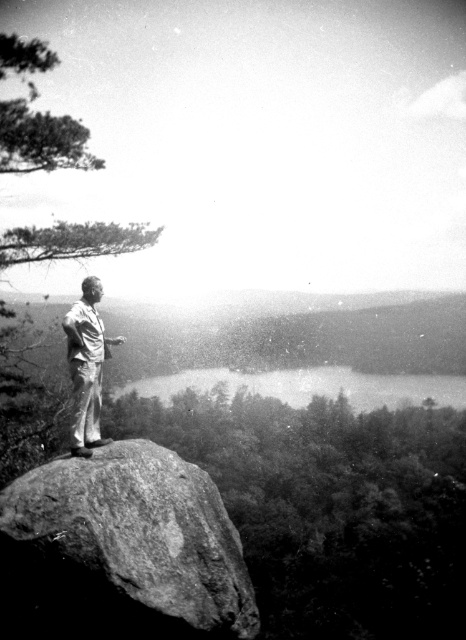
Can you confirm if smooth granite boulder at center is positioned to the right of smooth water at center?

Incorrect, smooth granite boulder at center is not on the right side of smooth water at center.

The height and width of the screenshot is (640, 466). I want to click on smooth granite boulder at center, so click(x=122, y=550).

Where is `smooth granite boulder at center`? This screenshot has width=466, height=640. smooth granite boulder at center is located at coordinates (122, 550).

Does smooth water at center come behind light beige cotton pants at center?

Yes, it is behind light beige cotton pants at center.

Between smooth water at center and light beige cotton pants at center, which one has more height?

smooth water at center is taller.

Where is `smooth water at center`? The width and height of the screenshot is (466, 640). smooth water at center is located at coordinates (309, 387).

Does point (39, 588) come farther from viewer compared to point (86, 380)?

That is False.

Between smooth granite boulder at center and light beige cotton pants at center, which one has less height?

smooth granite boulder at center is shorter.

Does point (95, 592) lie behind point (87, 428)?

No, it is not.

Where is `smooth granite boulder at center`? The height and width of the screenshot is (640, 466). smooth granite boulder at center is located at coordinates (122, 550).